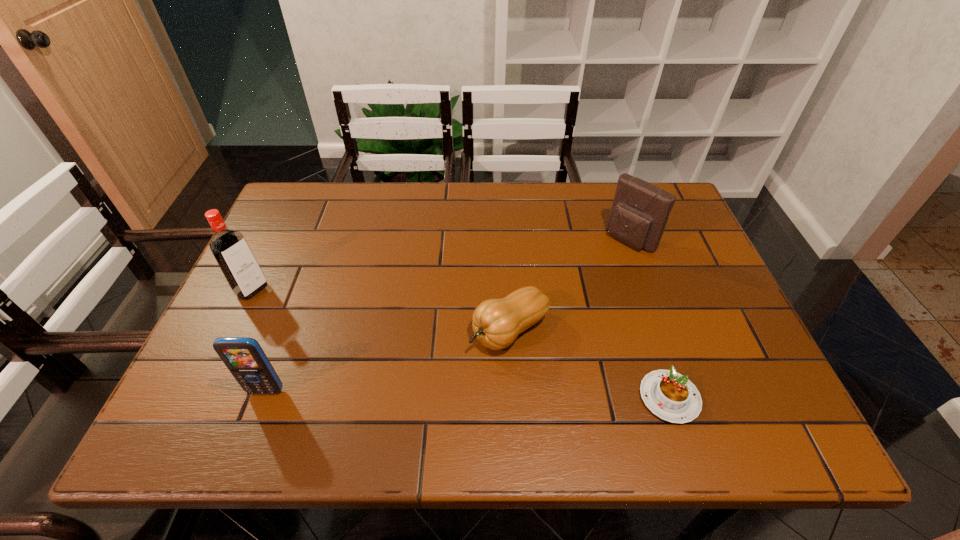
The width and height of the screenshot is (960, 540). Identify the location of vacant space that's between the vodka and the shortest object. (461, 343).

Where is `empty space between the pudding and the pouch`? empty space between the pudding and the pouch is located at coordinates (650, 319).

Locate which object ranks second in proximity to the farthest object. Please provide its 2D coordinates. Your answer should be formatted as a tuple, i.e. [(x, y)], where the tuple contains the x and y coordinates of a point satisfying the conditions above.

[(669, 395)]

Image resolution: width=960 pixels, height=540 pixels. What are the coordinates of `object that is the fourth closest to the second farthest object` in the screenshot? It's located at (640, 210).

Find the location of `free space that satisfies the following two spatial constraints: 1. on the screen of the fourth object from right to left; 2. on the right side of the shortest object`. free space that satisfies the following two spatial constraints: 1. on the screen of the fourth object from right to left; 2. on the right side of the shortest object is located at coordinates (264, 397).

Identify the location of free region that satisfies the following two spatial constraints: 1. on the front side of the vodka; 2. on the right side of the shortest object. The image size is (960, 540). click(200, 397).

Where is `vacant point that satisfies the following two spatial constraints: 1. on the back side of the shortest object; 2. on the left side of the farthest object`? The image size is (960, 540). vacant point that satisfies the following two spatial constraints: 1. on the back side of the shortest object; 2. on the left side of the farthest object is located at coordinates (617, 240).